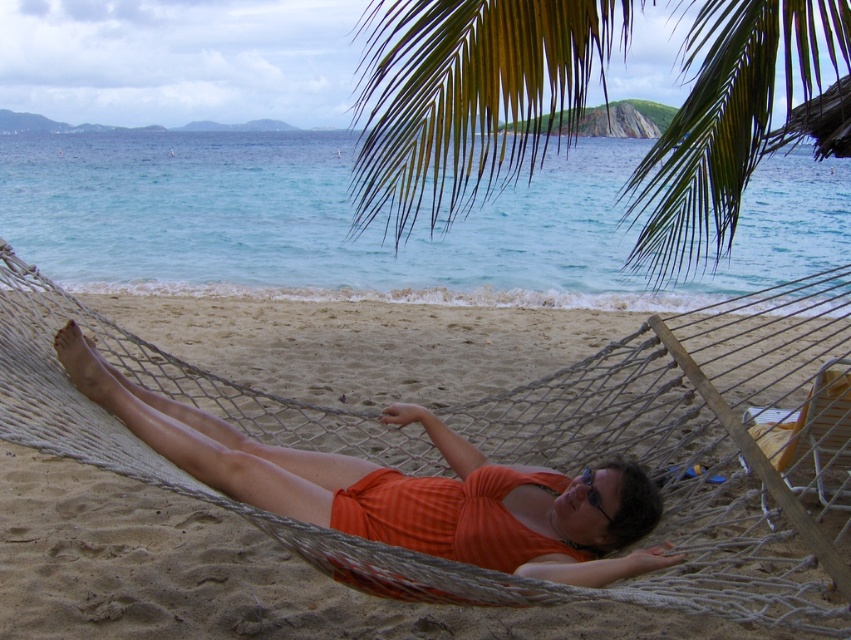
You are a photographer trying to capture the transparent plastic goggles at center without the green leafy palm tree at upper center blocking the view. Can you adjust your position so that the palm tree is no longer in front of the goggles?

The green leafy palm tree at upper center is positioned over transparent plastic goggles at center, so moving your position to the side or behind the goggles might allow you to capture them without the palm tree blocking the view.

You are planning to install a new hammock in your backyard and want to ensure there is enough space between the two support posts. The hammock you want is the same size as the orange fabric hammock at center. Given that the green leafy palm tree at upper center is taller than the hammock, does the tree height affect the distance needed between the posts for the hammock?

The height of the green leafy palm tree at upper center does not affect the distance needed between the support posts for the orange fabric hammock at center, as the tree is taller but the hammock requires spacing based on its own dimensions, not the tree height.

You are a photographer trying to capture the orange fabric hammock at center while ensuring the green leafy palm tree at upper center isn not blocking the view. Based on their positions, can you position yourself so that the palm tree doesn t obstruct the hammock?

The green leafy palm tree at upper center is located above the orange fabric hammock at center, so positioning yourself directly below or to the side of the hammock would keep the palm tree from blocking the view.